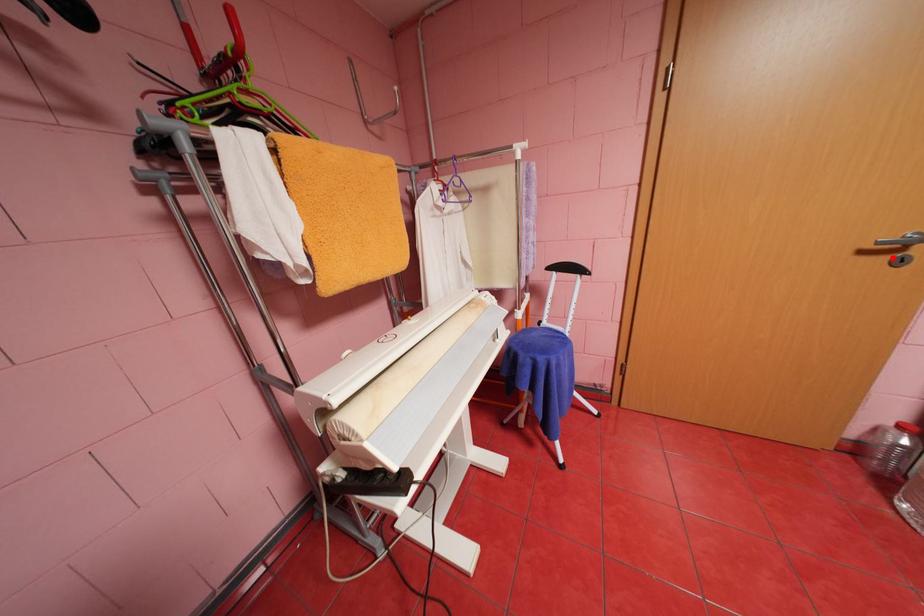
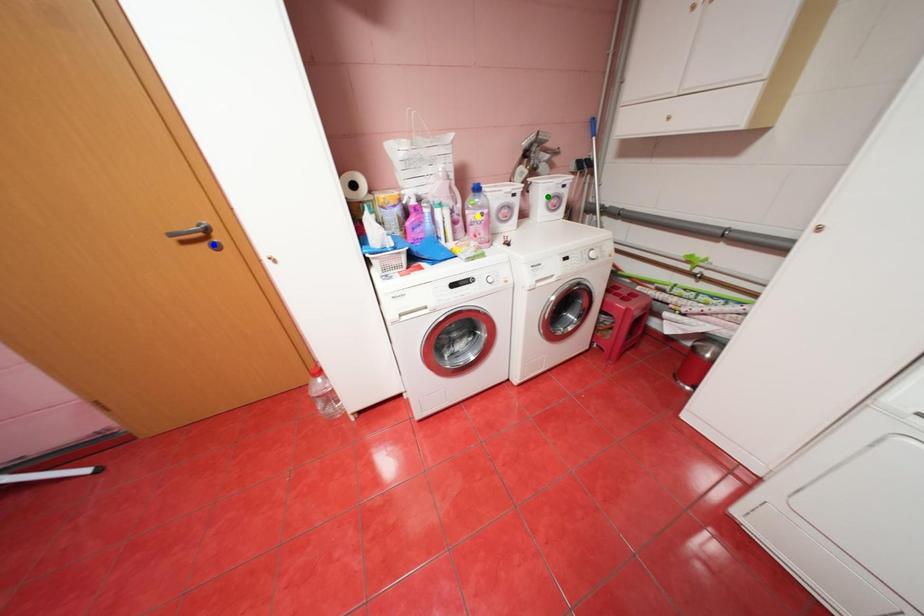
Question: I am providing you with two images of the same scene from different viewpoints. A red point is marked on the first image. You are given multiple points on the second image. Which point in image 2 is actually the same real-world point as the red point in image 1?

Choices:
 (A) blue point
 (B) green point
 (C) yellow point

Answer: (A)